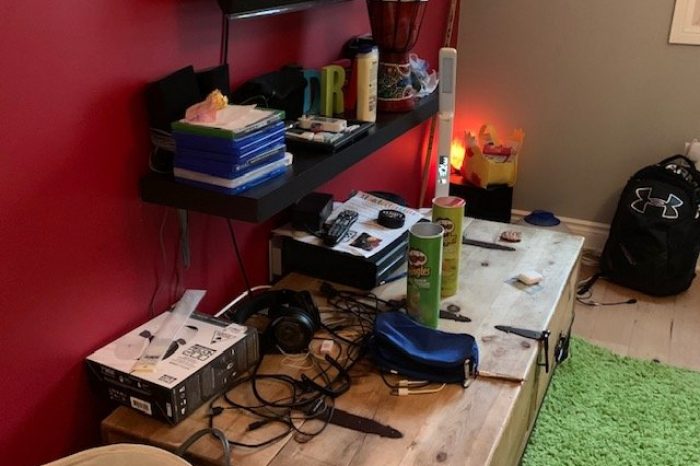
I want to click on dvd or blu ray player, so click(369, 273).